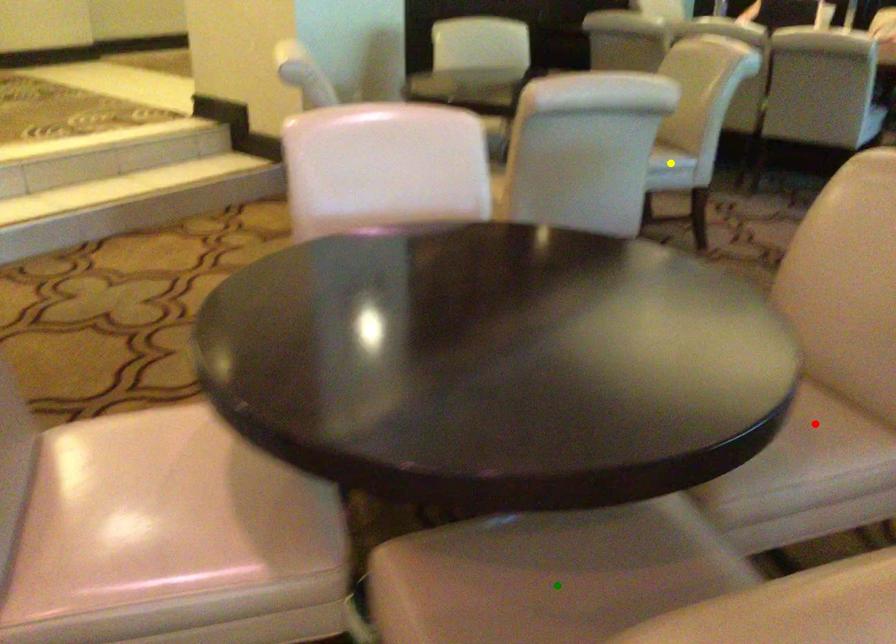
Order these from nearest to farthest:
- green point
- yellow point
- red point

1. yellow point
2. red point
3. green point